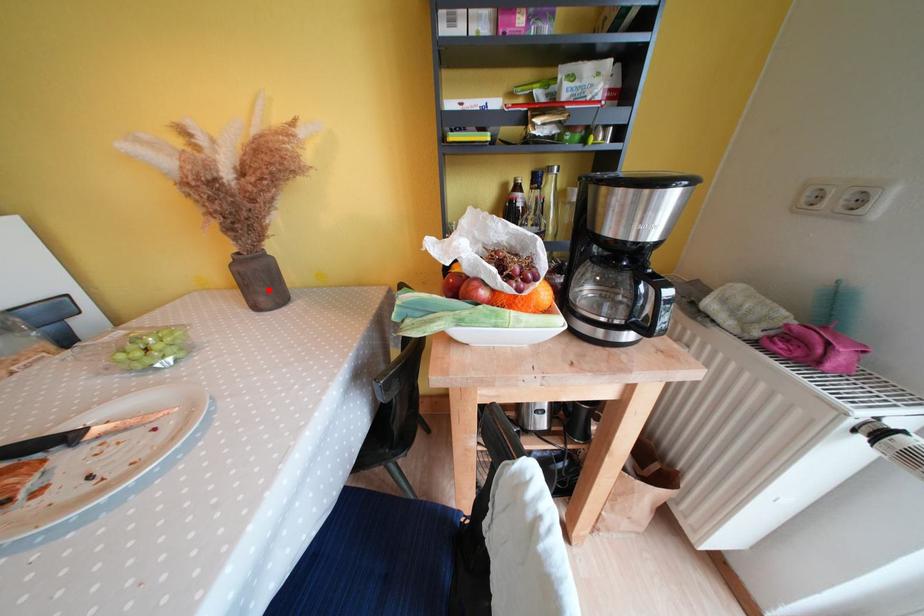
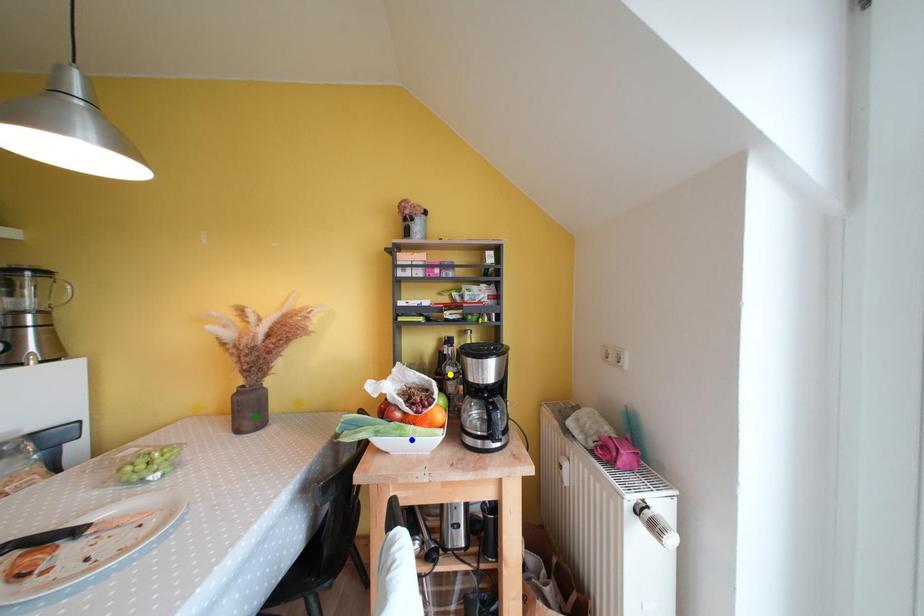
Question: I am providing you with two images of the same scene from different viewpoints. A red point is marked on the first image. You are given multiple points on the second image. Which spot in image 2 lines up with the point in image 1?

Choices:
 (A) blue point
 (B) green point
 (C) yellow point

Answer: (B)